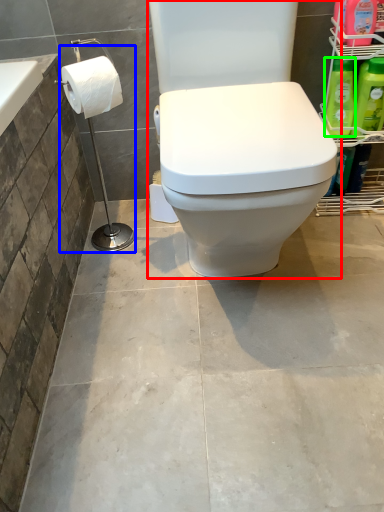
Question: Estimate the real-world distances between objects in this image. Which object is closer to toilet (highlighted by a red box), shower (highlighted by a blue box) or cleaning product (highlighted by a green box)?

Choices:
 (A) shower
 (B) cleaning product

Answer: (A)